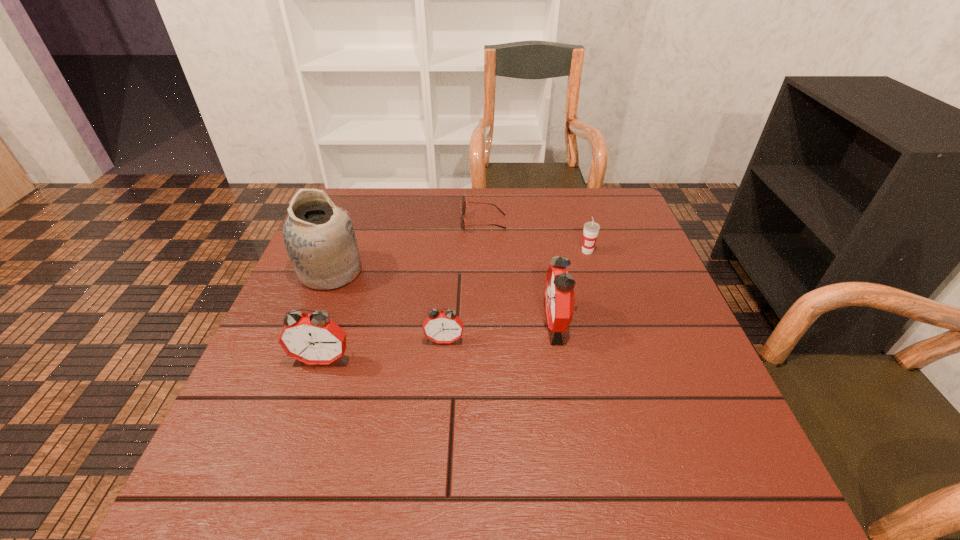
What are the coordinates of `empty location between the rightmost alarm clock and the sunglasses` in the screenshot? It's located at (520, 273).

Identify the location of free area in between the cup and the sunglasses. (536, 237).

You are a GUI agent. You are given a task and a screenshot of the screen. Output one action in this format:
    pyautogui.click(x=<x>, y=<y>)
    Task: Click on the free point between the second alarm clock from right to left and the pottery
    This screenshot has width=960, height=540.
    Given the screenshot: What is the action you would take?
    pyautogui.click(x=388, y=306)

This screenshot has width=960, height=540. Find the location of `free space between the pottery and the rightmost alarm clock`. free space between the pottery and the rightmost alarm clock is located at coordinates (444, 297).

Find the location of a particular element. The height and width of the screenshot is (540, 960). vacant region between the pottery and the rightmost object is located at coordinates (459, 261).

At what (x,y) coordinates should I click in order to perform the action: click on vacant point located between the rightmost object and the nearest object. Please return your answer as a coordinate pair (x, y). The height and width of the screenshot is (540, 960). Looking at the image, I should click on coord(455,305).

The height and width of the screenshot is (540, 960). In order to click on unoccupied position between the shortest object and the pottery in this screenshot , I will do `click(407, 247)`.

Where is `object identified as the third closest to the nearest object`? This screenshot has height=540, width=960. object identified as the third closest to the nearest object is located at coordinates (559, 290).

Find the location of `object that is the second nearest to the rightmost alarm clock`. object that is the second nearest to the rightmost alarm clock is located at coordinates (591, 229).

You are a GUI agent. You are given a task and a screenshot of the screen. Output one action in this format:
    pyautogui.click(x=<x>, y=<y>)
    Task: Click on the alarm clock that stands as the second closest to the second object from right to left
    This screenshot has width=960, height=540.
    Given the screenshot: What is the action you would take?
    pyautogui.click(x=314, y=338)